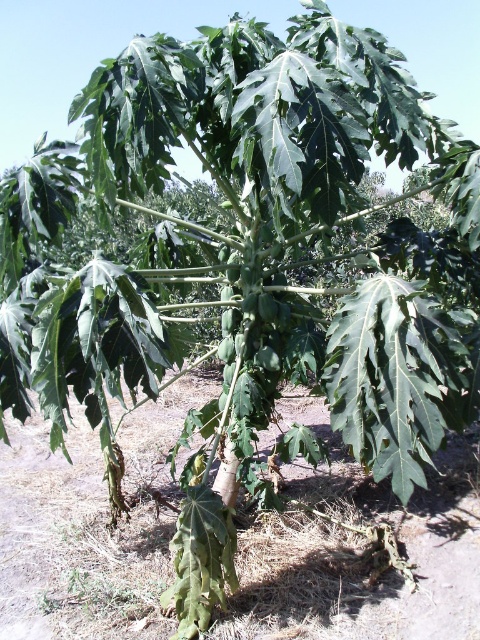
You are a gardener assessing the health of the papaya tree. You notice the brown dry soil at center and the green matte papaya at center. Which object is taller?

The green matte papaya at center is taller than the brown dry soil at center.

You are a gardener checking the papaya tree. You see the brown dry soil at center and the green matte papaya at center. Which one has a larger width?

The brown dry soil at center might be wider than green matte papaya at center.

You are a gardener checking the health of the papaya tree. You notice the brown dry soil at center and the green matte papaya at center. Which object is positioned to the left of the other?

The brown dry soil at center is to the left of the green matte papaya at center.